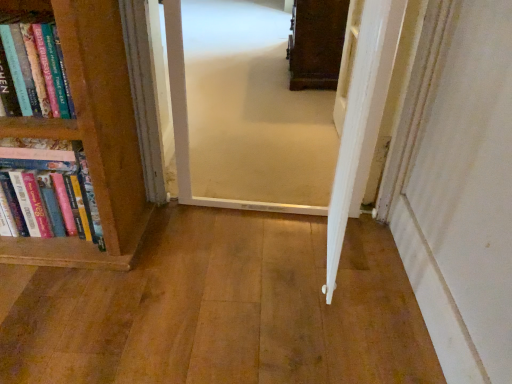
Question: Which direction should I rotate to look at wooden floor at center, which ranks as the first corridor in bottom-to-top order, — up or down?

Choices:
 (A) down
 (B) up

Answer: (A)

Question: Should I look upward or downward to see carpeted corridor at center, the first corridor from the top?

Choices:
 (A) down
 (B) up

Answer: (B)

Question: Is hardcover books at left at the back of wooden floor at center, which ranks as the first corridor in bottom-to-top order?

Choices:
 (A) no
 (B) yes

Answer: (A)

Question: From a real-world perspective, is wooden floor at center, arranged as the second corridor when viewed from the top, below hardcover books at left?

Choices:
 (A) yes
 (B) no

Answer: (A)

Question: Are wooden floor at center, arranged as the second corridor when viewed from the top, and hardcover books at left far apart?

Choices:
 (A) no
 (B) yes

Answer: (A)

Question: Is wooden floor at center, arranged as the second corridor when viewed from the top, shorter than hardcover books at left?

Choices:
 (A) no
 (B) yes

Answer: (B)

Question: Does wooden floor at center, arranged as the second corridor when viewed from the top, have a greater height compared to hardcover books at left?

Choices:
 (A) yes
 (B) no

Answer: (B)

Question: Considering the relative sizes of wooden floor at center, which ranks as the first corridor in bottom-to-top order, and hardcover books at left in the image provided, is wooden floor at center, which ranks as the first corridor in bottom-to-top order, thinner than hardcover books at left?

Choices:
 (A) yes
 (B) no

Answer: (B)

Question: Is hardcover books at left facing away from carpeted corridor at center, the first corridor from the top?

Choices:
 (A) yes
 (B) no

Answer: (B)

Question: From a real-world perspective, is hardcover books at left under carpeted corridor at center, the first corridor from the top?

Choices:
 (A) no
 (B) yes

Answer: (B)

Question: Considering the relative positions of hardcover books at left and carpeted corridor at center, the first corridor from the top, in the image provided, is hardcover books at left to the left of carpeted corridor at center, the first corridor from the top, from the viewer's perspective?

Choices:
 (A) yes
 (B) no

Answer: (A)

Question: Does hardcover books at left have a lesser width compared to carpeted corridor at center, which appears as the second corridor when ordered from the bottom?

Choices:
 (A) yes
 (B) no

Answer: (A)

Question: Does hardcover books at left lie in front of carpeted corridor at center, which appears as the second corridor when ordered from the bottom?

Choices:
 (A) no
 (B) yes

Answer: (B)

Question: Does hardcover books at left have a greater height compared to carpeted corridor at center, which appears as the second corridor when ordered from the bottom?

Choices:
 (A) no
 (B) yes

Answer: (A)

Question: From a real-world perspective, is wooden floor at center, arranged as the second corridor when viewed from the top, physically above carpeted corridor at center, the first corridor from the top?

Choices:
 (A) no
 (B) yes

Answer: (A)